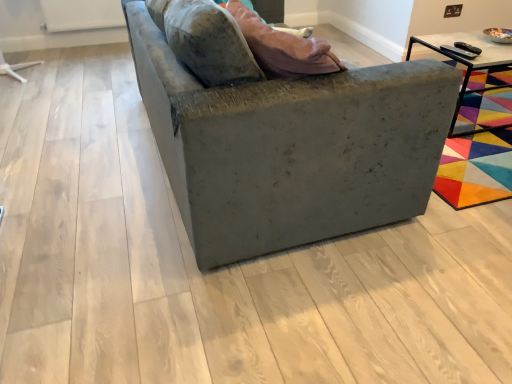
What is the approximate width of velvet gray couch at center?

It is 3.35 feet.

What do you see at coordinates (291, 148) in the screenshot?
I see `velvet gray couch at center` at bounding box center [291, 148].

Locate an element on the screen. velvet gray couch at center is located at coordinates tap(291, 148).

Identify the location of black metal table at upper right. (468, 65).

Describe the element at coordinates (468, 65) in the screenshot. Image resolution: width=512 pixels, height=384 pixels. I see `black metal table at upper right` at that location.

Identify the location of velvet gray couch at center. This screenshot has width=512, height=384. (291, 148).

Is velvet gray couch at center to the left of black metal table at upper right from the viewer's perspective?

Indeed, velvet gray couch at center is positioned on the left side of black metal table at upper right.

Is the position of velvet gray couch at center more distant than that of black metal table at upper right?

No, the depth of velvet gray couch at center is less than that of black metal table at upper right.

Between point (385, 182) and point (407, 58), which one is positioned behind?

The point (407, 58) is more distant.

From the image's perspective, which object appears higher, velvet gray couch at center or black metal table at upper right?

black metal table at upper right is shown above in the image.

From a real-world perspective, who is located higher, velvet gray couch at center or black metal table at upper right?

velvet gray couch at center.

Is velvet gray couch at center wider than black metal table at upper right?

Indeed, velvet gray couch at center has a greater width compared to black metal table at upper right.

Considering the relative sizes of velvet gray couch at center and black metal table at upper right in the image provided, is velvet gray couch at center taller than black metal table at upper right?

Yes, velvet gray couch at center is taller than black metal table at upper right.

Who is bigger, velvet gray couch at center or black metal table at upper right?

velvet gray couch at center is bigger.

Is velvet gray couch at center spatially inside black metal table at upper right, or outside of it?

velvet gray couch at center cannot be found inside black metal table at upper right.

Looking at this image, are velvet gray couch at center and black metal table at upper right far apart?

Yes, velvet gray couch at center is far from black metal table at upper right.

Is velvet gray couch at center turned away from black metal table at upper right?

velvet gray couch at center does not have its back to black metal table at upper right.

How distant is velvet gray couch at center from black metal table at upper right?

The distance of velvet gray couch at center from black metal table at upper right is 1.37 meters.

Locate an element on the screen. The width and height of the screenshot is (512, 384). table above the velvet gray couch at center (from the image's perspective) is located at coordinates (468, 65).

Based on their positions, is black metal table at upper right located to the left or right of velvet gray couch at center?

black metal table at upper right is to the right of velvet gray couch at center.

Which object is closer to the camera taking this photo, black metal table at upper right or velvet gray couch at center?

→ velvet gray couch at center.

Does point (460, 95) lie behind point (267, 228)?

Yes, it is behind point (267, 228).

From the image's perspective, which is below, black metal table at upper right or velvet gray couch at center?

velvet gray couch at center appears lower in the image.

From a real-world perspective, which is physically above, black metal table at upper right or velvet gray couch at center?

From a 3D spatial view, velvet gray couch at center is above.

Considering the sizes of objects black metal table at upper right and velvet gray couch at center in the image provided, who is wider, black metal table at upper right or velvet gray couch at center?

With larger width is velvet gray couch at center.

From their relative heights in the image, would you say black metal table at upper right is taller or shorter than velvet gray couch at center?

black metal table at upper right is shorter than velvet gray couch at center.

Between black metal table at upper right and velvet gray couch at center, which one has smaller size?

With smaller size is black metal table at upper right.

Is velvet gray couch at center located within black metal table at upper right?

No, velvet gray couch at center is not surrounded by black metal table at upper right.

Is black metal table at upper right in contact with velvet gray couch at center?

No, black metal table at upper right is not next to velvet gray couch at center.

Could you tell me if black metal table at upper right is facing velvet gray couch at center?

Yes, black metal table at upper right is oriented towards velvet gray couch at center.

Can you tell me how much black metal table at upper right and velvet gray couch at center differ in facing direction?

black metal table at upper right and velvet gray couch at center are facing 179 degrees away from each other.

The width and height of the screenshot is (512, 384). In order to click on studio couch that is below the black metal table at upper right (from the image's perspective) in this screenshot , I will do `click(291, 148)`.

I want to click on studio couch above the black metal table at upper right (from a real-world perspective), so click(291, 148).

Find the location of a particular element. studio couch below the black metal table at upper right (from the image's perspective) is located at coordinates (291, 148).